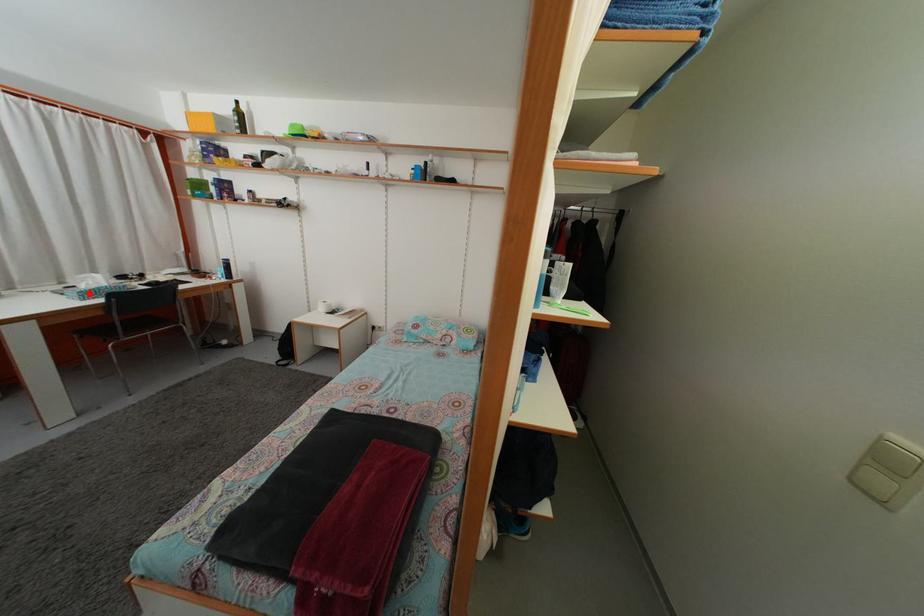
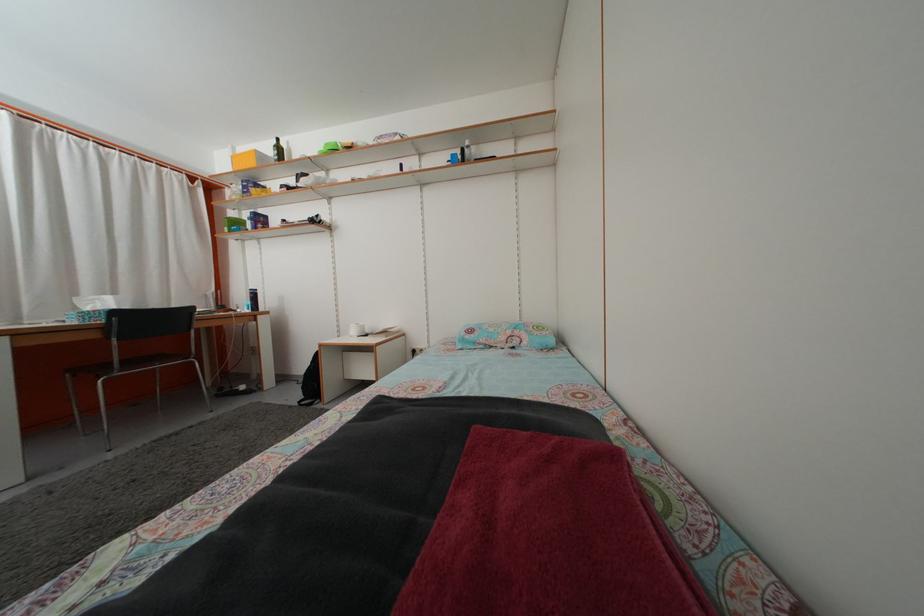
The point at the highlighted location is marked in the first image. Where is the corresponding point in the second image?

(94, 317)